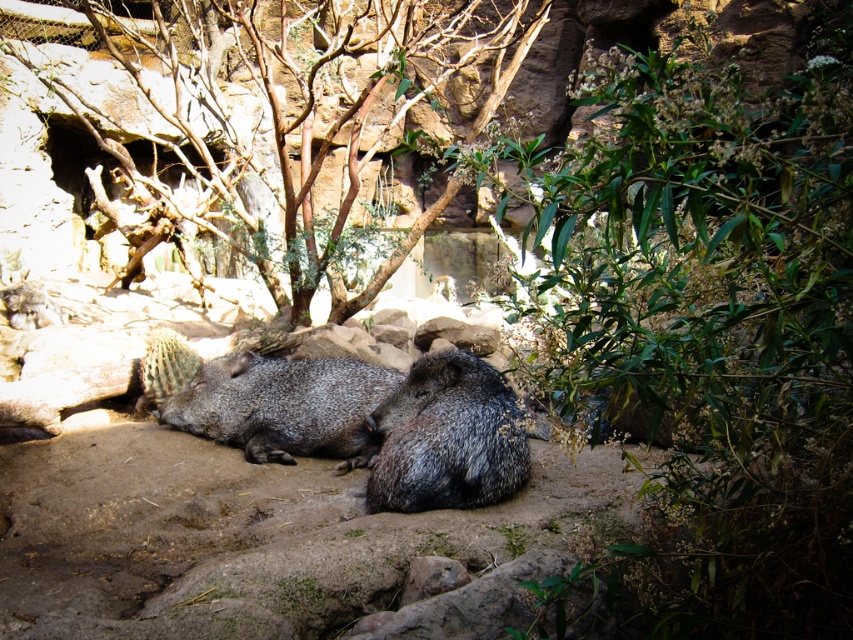
Question: From the image, what is the correct spatial relationship of green leafy plant at center in relation to brown rough bark tree at center?

Choices:
 (A) left
 (B) right

Answer: (B)

Question: Estimate the real-world distances between objects in this image. Which object is farther from the green leafy plant at center?

Choices:
 (A) gray spiny at center
 (B) brown rough bark tree at center

Answer: (B)

Question: Which point is closer to the camera?

Choices:
 (A) (817, 52)
 (B) (459, 490)
 (C) (398, 72)
 (D) (296, 394)

Answer: (C)

Question: Which of the following is the farthest from the observer?

Choices:
 (A) green leafy plant at center
 (B) brown rough bark tree at center

Answer: (B)

Question: Does green leafy plant at center have a smaller size compared to brown rough bark tree at center?

Choices:
 (A) yes
 (B) no

Answer: (A)

Question: Does green leafy plant at center have a lesser width compared to brown rough bark tree at center?

Choices:
 (A) no
 (B) yes

Answer: (B)